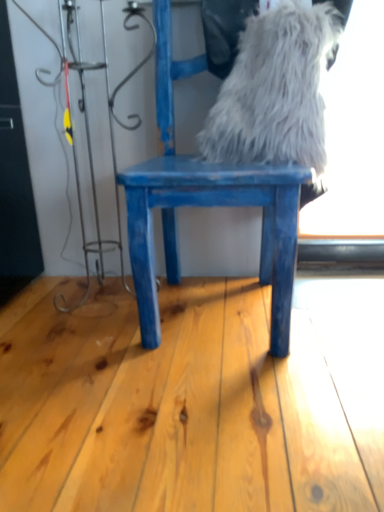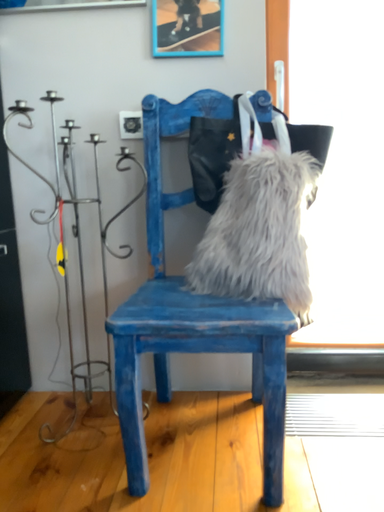
Question: How did the camera likely rotate when shooting the video?

Choices:
 (A) rotated downward
 (B) rotated upward

Answer: (B)